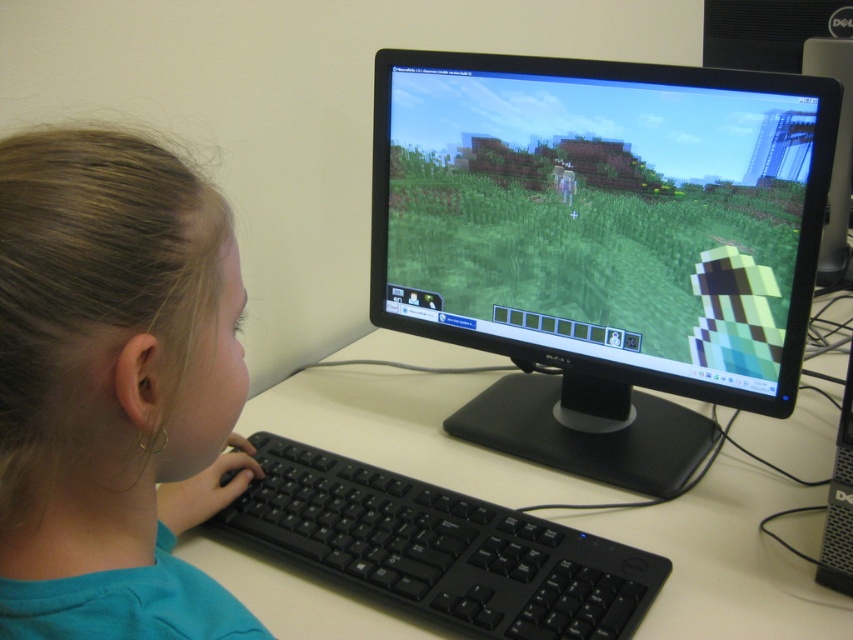
Where is the smooth skin face at center located in the image?

The smooth skin face at center is located at point coordinates of (114, 388).

You are setting up a desk and want to place a decorative item between the black matte monitor at center and the black plastic tower at right. Which object should you place the item closer to if you want it to be near the taller object?

The black matte monitor at center is taller than the black plastic tower at right, so you should place the decorative item closer to the black matte monitor at center.